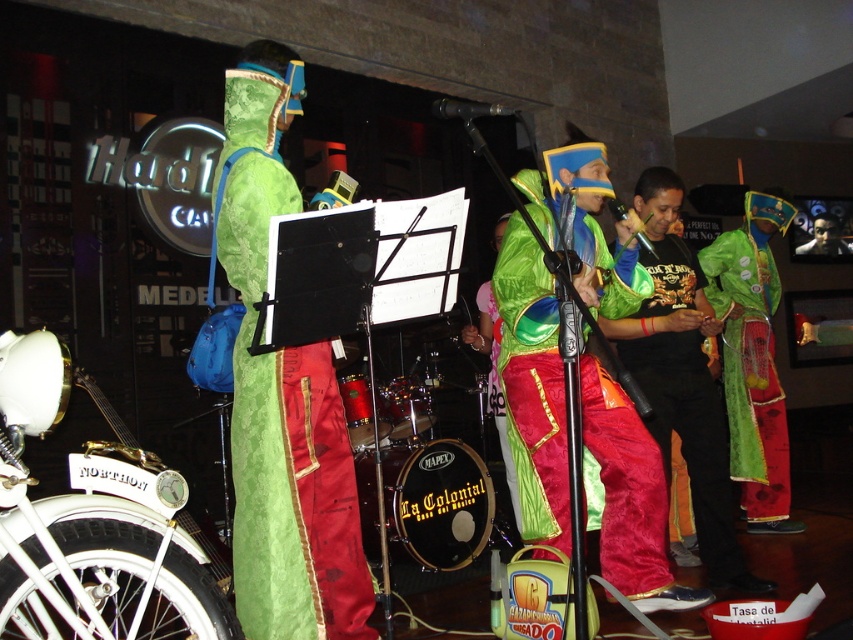
You are a photographer at the Hard Rock Cafe performance. You need to capture a closeup of the green velvet costume at center. The camera is currently focused at point [282,403]. Is the green velvet costume at center in focus?

Yes, the camera is focused at point [282,403], which indicates the green velvet costume at center is in focus.

From the picture: You are a photographer standing at the back of the Hard Rock Cafe stage. You need to capture a photo of both the green velvet costume at center and the shiny metallic pants at center in the same frame. Given that your camera has a minimum focus distance of 2 meters, will you be able to take the photo without moving closer?

The distance between the green velvet costume at center and the shiny metallic pants at center is 1.80 meters. Since your camera requires a minimum focus distance of 2 meters, you will need to move slightly closer to ensure both are in frame.

You are a photographer at the Hard Rock Cafe performance. You need to capture a photo that includes both the green velvet costume at center and the velvet green and red costume at center. Which costume should you focus on first to ensure both are in frame?

The green velvet costume at center is located above the velvet green and red costume at center, so focusing on the upper part of the frame first will ensure both are captured in the photo.